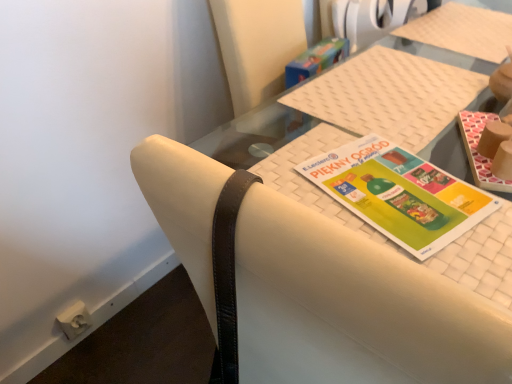
Question: In which direction should I rotate to look at multicolored paper at center, positioned as the 2th book in right-to-left order?

Choices:
 (A) left
 (B) right

Answer: (B)

Question: From the image's perspective, is white woven placemat at center above matte brown book at upper right, placed as the second book when sorted from left to right?

Choices:
 (A) no
 (B) yes

Answer: (A)

Question: Is white woven placemat at center further to the viewer compared to matte brown book at upper right, placed as the second book when sorted from left to right?

Choices:
 (A) yes
 (B) no

Answer: (B)

Question: Is white woven placemat at center far from matte brown book at upper right, placed as the second book when sorted from left to right?

Choices:
 (A) no
 (B) yes

Answer: (A)

Question: Considering the relative sizes of white woven placemat at center and matte brown book at upper right, placed as the second book when sorted from left to right, in the image provided, is white woven placemat at center smaller than matte brown book at upper right, placed as the second book when sorted from left to right,?

Choices:
 (A) no
 (B) yes

Answer: (A)

Question: Is white woven placemat at center oriented away from matte brown book at upper right, positioned as the first book in right-to-left order?

Choices:
 (A) no
 (B) yes

Answer: (A)

Question: Is white woven placemat at center aimed at matte brown book at upper right, placed as the second book when sorted from left to right?

Choices:
 (A) yes
 (B) no

Answer: (B)

Question: Is white woven placemat at center bigger than multicolored paper at center, positioned as the 2th book in right-to-left order?

Choices:
 (A) yes
 (B) no

Answer: (A)

Question: Does white woven placemat at center turn towards multicolored paper at center, positioned as the 1th book in left-to-right order?

Choices:
 (A) no
 (B) yes

Answer: (A)

Question: Is multicolored paper at center, positioned as the 2th book in right-to-left order, at the back of white woven placemat at center?

Choices:
 (A) no
 (B) yes

Answer: (A)

Question: Considering the relative sizes of white woven placemat at center and multicolored paper at center, positioned as the 1th book in left-to-right order, in the image provided, is white woven placemat at center smaller than multicolored paper at center, positioned as the 1th book in left-to-right order,?

Choices:
 (A) yes
 (B) no

Answer: (B)

Question: From the image's perspective, is white woven placemat at center located above multicolored paper at center, positioned as the 2th book in right-to-left order?

Choices:
 (A) yes
 (B) no

Answer: (A)

Question: From the image's perspective, is white woven placemat at center under multicolored paper at center, positioned as the 2th book in right-to-left order?

Choices:
 (A) yes
 (B) no

Answer: (B)

Question: Does white leather chair at center have a lesser width compared to matte brown book at upper right, positioned as the first book in right-to-left order?

Choices:
 (A) yes
 (B) no

Answer: (B)